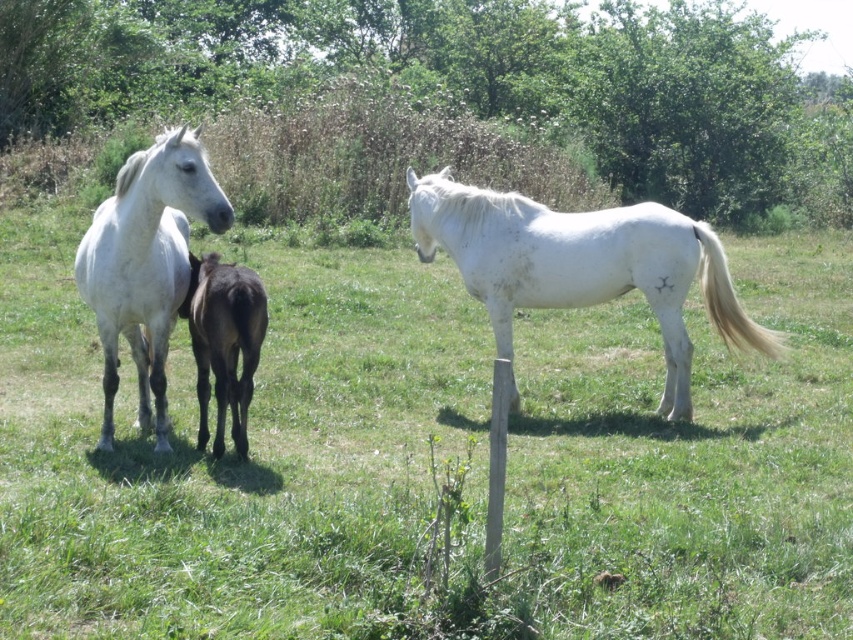
Question: Which of the following is the farthest from the observer?

Choices:
 (A) (659, 468)
 (B) (132, 157)
 (C) (770, 332)

Answer: (C)

Question: Which point appears farthest from the camera in this image?

Choices:
 (A) (144, 349)
 (B) (677, 440)
 (C) (500, 477)

Answer: (B)

Question: Where is white glossy horse at center located in relation to white glossy horse at left in the image?

Choices:
 (A) above
 (B) below

Answer: (B)

Question: Can you confirm if white matte horse at right is smaller than smooth wooden post at center?

Choices:
 (A) no
 (B) yes

Answer: (A)

Question: Is white matte horse at right smaller than white glossy horse at left?

Choices:
 (A) yes
 (B) no

Answer: (B)

Question: Which point is closer to the camera?

Choices:
 (A) white matte horse at right
 (B) white glossy horse at center

Answer: (B)